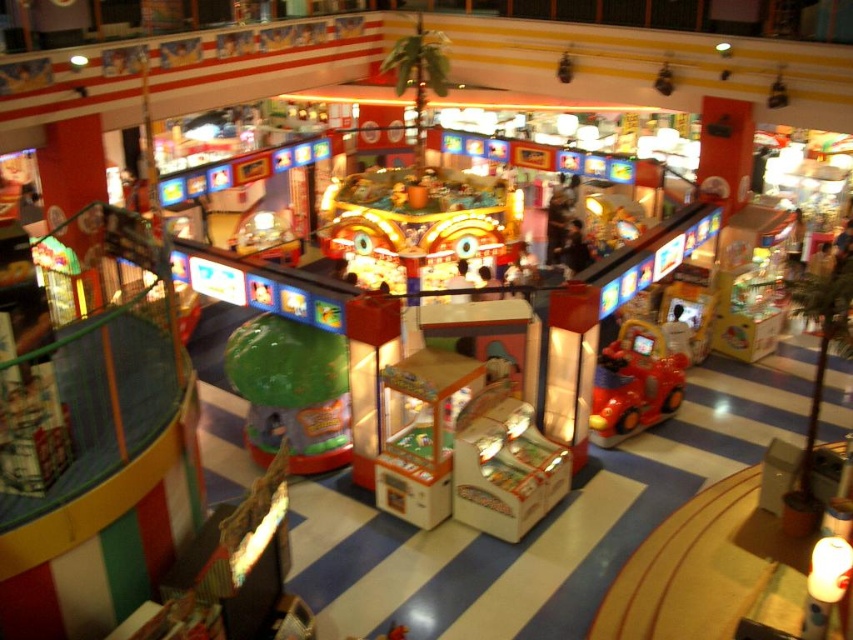
Question: Which of the following is the closest to the observer?

Choices:
 (A) (631, 419)
 (B) (260, 420)
 (C) (399, 234)

Answer: (B)

Question: Which of the following is the closest to the observer?

Choices:
 (A) (614, 429)
 (B) (258, 380)
 (C) (413, 237)

Answer: (B)

Question: Does shiny metallic claw machine at center appear over shiny red plastic car at center?

Choices:
 (A) yes
 (B) no

Answer: (A)

Question: Estimate the real-world distances between objects in this image. Which object is closer to the shiny red plastic car at center?

Choices:
 (A) green matte mushroom at center
 (B) shiny metallic claw machine at center

Answer: (B)

Question: Where is shiny metallic claw machine at center located in relation to shiny red plastic car at center in the image?

Choices:
 (A) left
 (B) right

Answer: (A)

Question: Does shiny metallic claw machine at center have a greater width compared to green matte mushroom at center?

Choices:
 (A) yes
 (B) no

Answer: (A)